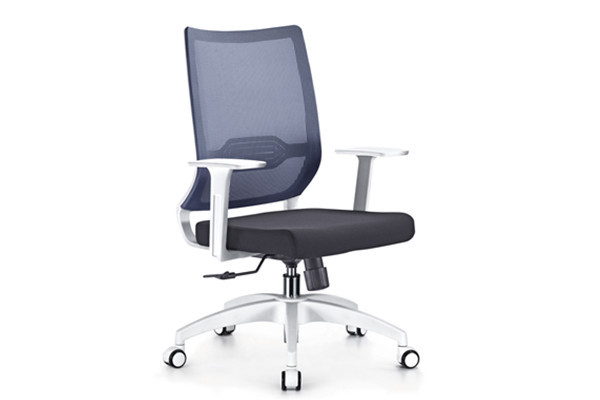
Find the location of a particular element. This screenshot has height=400, width=600. 2 gray panels is located at coordinates (250, 83), (260, 182).